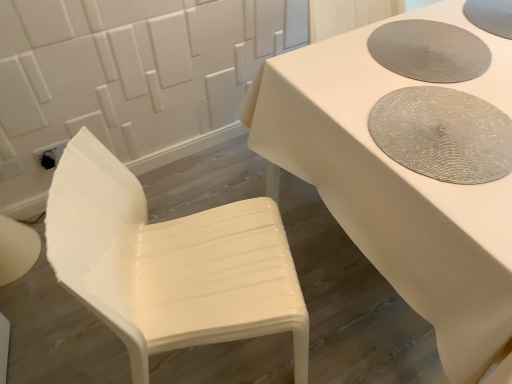
Image resolution: width=512 pixels, height=384 pixels. What are the coordinates of `free space to the left of textured gray placemat at upper right, the second manhole cover positioned from the bottom` in the screenshot? It's located at (333, 72).